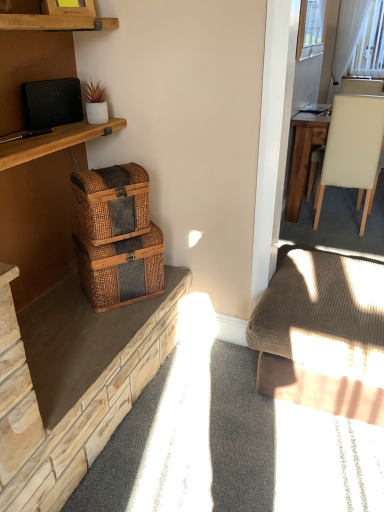
Question: Can you confirm if black matte speaker at upper left is positioned to the right of woven brown picnic basket at left, placed as the 1th picnic basket when sorted from top to bottom?

Choices:
 (A) yes
 (B) no

Answer: (B)

Question: Is black matte speaker at upper left oriented towards woven brown picnic basket at left, placed as the 1th picnic basket when sorted from top to bottom?

Choices:
 (A) yes
 (B) no

Answer: (B)

Question: Is black matte speaker at upper left thinner than woven brown picnic basket at left, placed as the 1th picnic basket when sorted from top to bottom?

Choices:
 (A) no
 (B) yes

Answer: (B)

Question: Is woven brown picnic basket at left, placed as the 1th picnic basket when sorted from top to bottom, a part of black matte speaker at upper left?

Choices:
 (A) yes
 (B) no

Answer: (B)

Question: Are black matte speaker at upper left and woven brown picnic basket at left, placed as the 1th picnic basket when sorted from top to bottom, located far from each other?

Choices:
 (A) yes
 (B) no

Answer: (B)

Question: From the image's perspective, is black matte speaker at upper left located beneath woven brown picnic basket at left, placed as the 1th picnic basket when sorted from top to bottom?

Choices:
 (A) yes
 (B) no

Answer: (B)

Question: Does woven brown picnic basket at lower left, the 2th picnic basket viewed from the top, have a lesser width compared to white sheer curtain at upper right?

Choices:
 (A) yes
 (B) no

Answer: (B)

Question: From a real-world perspective, is woven brown picnic basket at lower left, the 2th picnic basket viewed from the top, on white sheer curtain at upper right?

Choices:
 (A) no
 (B) yes

Answer: (A)

Question: From the image's perspective, is woven brown picnic basket at lower left, the 2th picnic basket viewed from the top, over white sheer curtain at upper right?

Choices:
 (A) yes
 (B) no

Answer: (B)

Question: Can you see woven brown picnic basket at lower left, the 2th picnic basket viewed from the top, touching white sheer curtain at upper right?

Choices:
 (A) yes
 (B) no

Answer: (B)

Question: Considering the relative sizes of woven brown picnic basket at lower left, the 2th picnic basket viewed from the top, and white sheer curtain at upper right in the image provided, is woven brown picnic basket at lower left, the 2th picnic basket viewed from the top, taller than white sheer curtain at upper right?

Choices:
 (A) no
 (B) yes

Answer: (A)

Question: Considering the relative sizes of woven brown picnic basket at lower left, the 2th picnic basket viewed from the top, and white sheer curtain at upper right in the image provided, is woven brown picnic basket at lower left, the 2th picnic basket viewed from the top, bigger than white sheer curtain at upper right?

Choices:
 (A) no
 (B) yes

Answer: (A)

Question: Considering the relative positions of woven wood baskets at left and black matte speaker at upper left in the image provided, is woven wood baskets at left behind black matte speaker at upper left?

Choices:
 (A) yes
 (B) no

Answer: (B)